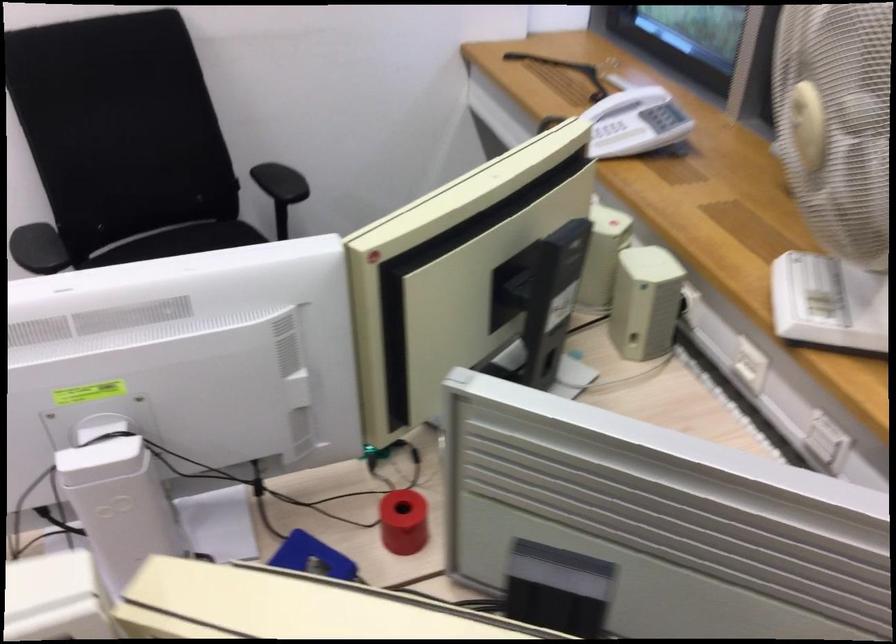
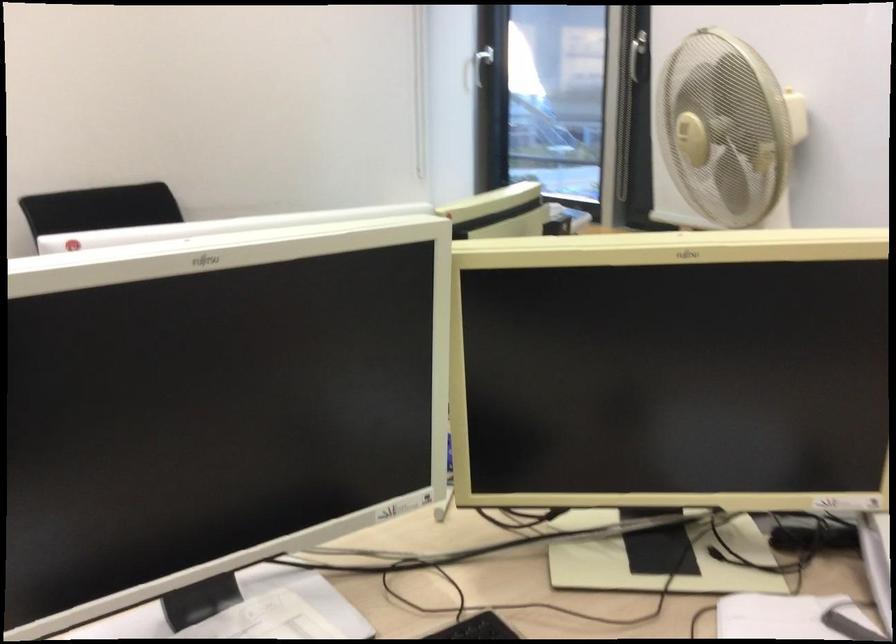
Question: I am providing you with two images of the same scene from different viewpoints. Please identify which objects are invisible in image2.

Choices:
 (A) scanner lid
 (B) white window handle
 (C) padded chest support
 (D) telephone handset

Answer: (D)